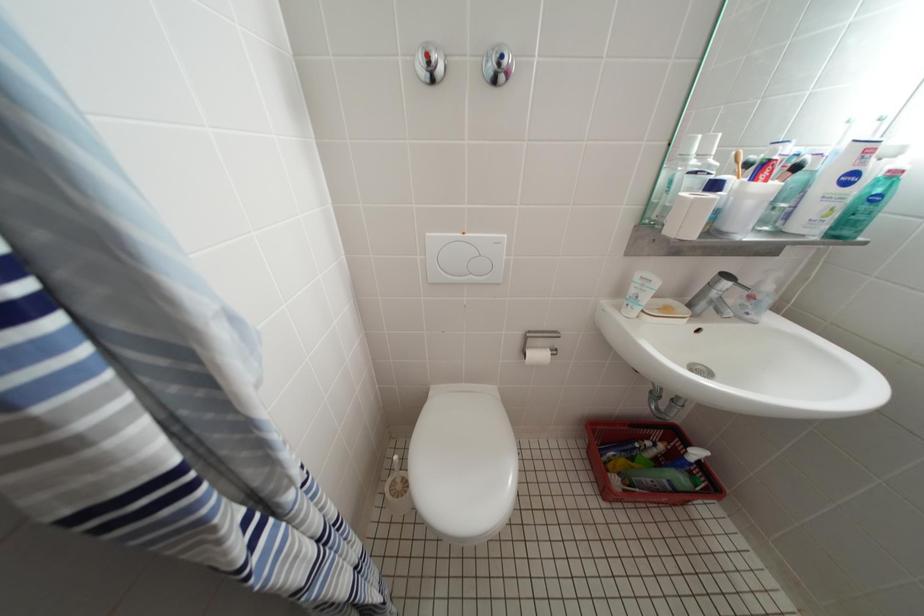
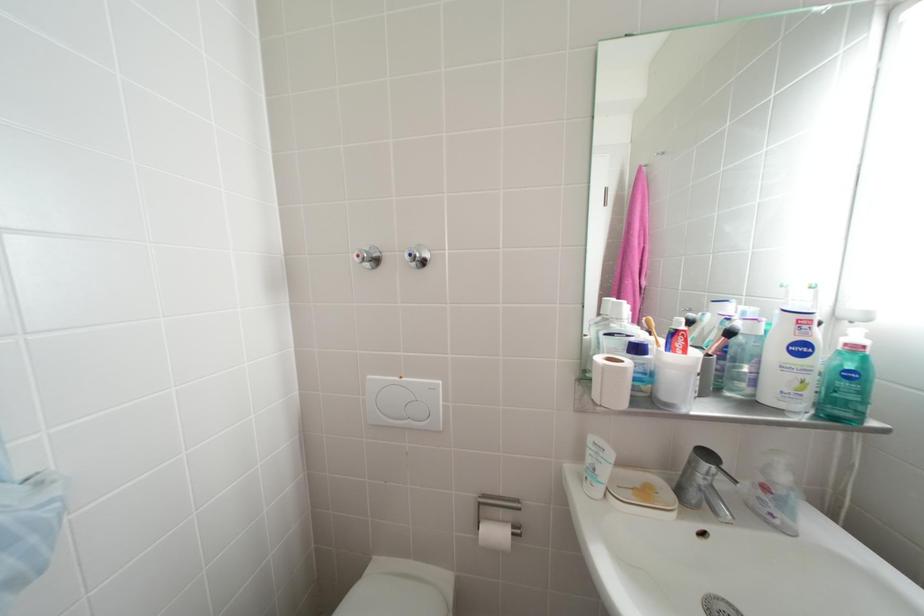
Question: In a continuous first-person perspective shot, in which direction is the camera moving?

Choices:
 (A) Left
 (B) Right
 (C) Forward
 (D) Backward

Answer: (B)